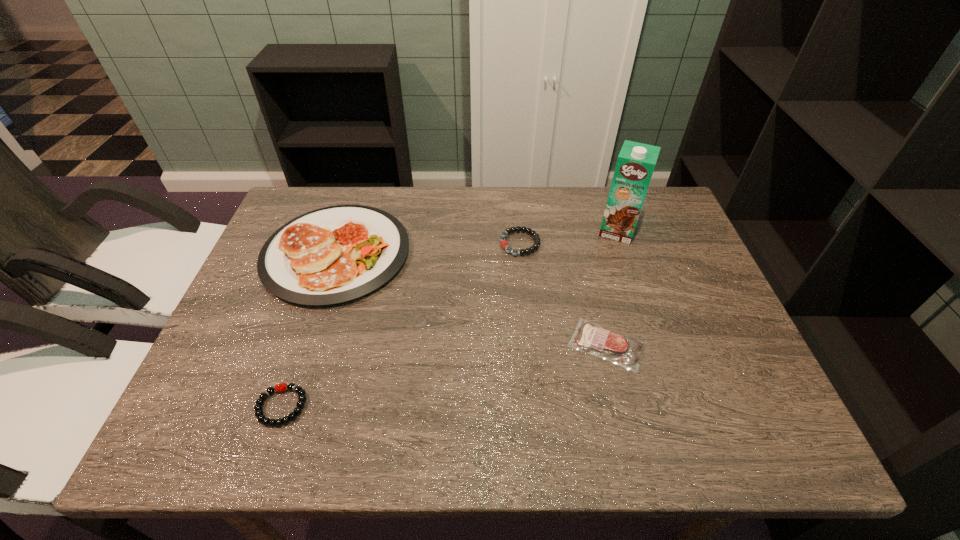
This screenshot has width=960, height=540. What are the coordinates of `the tallest object` in the screenshot? It's located at (636, 161).

Where is `the fourth shortest object`? the fourth shortest object is located at coordinates [x=332, y=255].

Locate an element on the screen. Image resolution: width=960 pixels, height=540 pixels. the farther bracelet is located at coordinates (504, 244).

Locate an element on the screen. This screenshot has width=960, height=540. the third object from left to right is located at coordinates (504, 244).

This screenshot has width=960, height=540. What are the coordinates of `the fourth farthest object` in the screenshot? It's located at (588, 337).

Where is `the shorter bracelet`? The image size is (960, 540). the shorter bracelet is located at coordinates (300, 404).

At what (x,y) coordinates should I click in order to perform the action: click on the left bracelet. Please return your answer as a coordinate pair (x, y). This screenshot has width=960, height=540. Looking at the image, I should click on (300, 404).

The image size is (960, 540). Identify the location of free space located on the left of the tallest object. (515, 231).

You are a GUI agent. You are given a task and a screenshot of the screen. Output one action in this format:
    pyautogui.click(x=<x>, y=<y>)
    Task: Click on the vacant position located on the right of the second tallest object
    
    Given the screenshot: What is the action you would take?
    pyautogui.click(x=485, y=253)

Find the location of `vacant space located on the back of the farther bracelet`. vacant space located on the back of the farther bracelet is located at coordinates (516, 195).